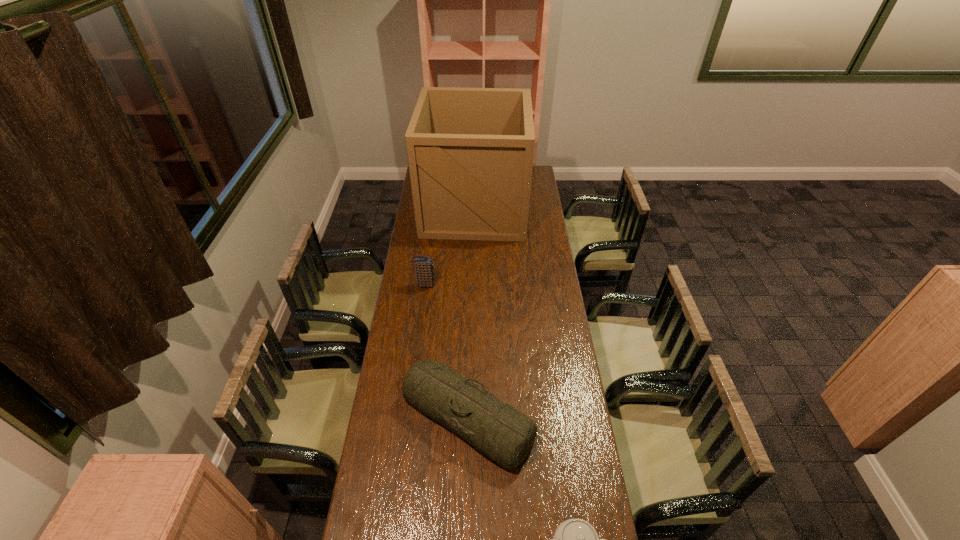
Identify which object is the third closest to the farthest object. Please provide its 2D coordinates. Your answer should be formatted as a tuple, i.e. [(x, y)], where the tuple contains the x and y coordinates of a point satisfying the conditions above.

[(574, 539)]

What are the coordinates of `free point that satisfies the following two spatial constraints: 1. with the zip open on the clutch bag; 2. on the right side of the third farthest object` in the screenshot? It's located at (408, 417).

This screenshot has height=540, width=960. Identify the location of free region that satisfies the following two spatial constraints: 1. on the back side of the second nearest object; 2. on the left side of the box. click(472, 208).

I want to click on vacant position in the image that satisfies the following two spatial constraints: 1. on the back side of the duffel bag; 2. with the zip open on the second farthest object, so click(470, 285).